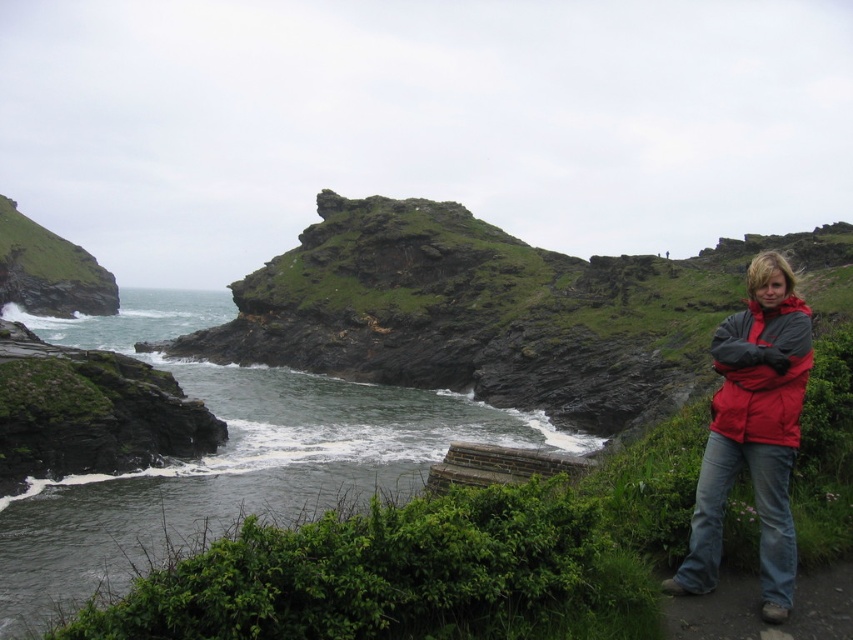
Does red fleece jacket at right have a greater height compared to brown dirt path at lower right?

Yes.

Between red fleece jacket at right and brown dirt path at lower right, which one has less height?

Standing shorter between the two is brown dirt path at lower right.

Is point (743, 400) farther from viewer compared to point (726, 602)?

That is True.

Locate an element on the screen. The image size is (853, 640). red fleece jacket at right is located at coordinates (762, 372).

Does greenish-gray water at center-left have a lesser height compared to green grassy hillside at left?

Indeed, greenish-gray water at center-left has a lesser height compared to green grassy hillside at left.

Is greenish-gray water at center-left to the left of green grassy hillside at left from the viewer's perspective?

No, greenish-gray water at center-left is not to the left of green grassy hillside at left.

Between point (148, 304) and point (56, 266), which one is positioned behind?

The point (148, 304) is behind.

This screenshot has width=853, height=640. Find the location of `greenish-gray water at center-left`. greenish-gray water at center-left is located at coordinates (225, 458).

Which is behind, point (784, 339) or point (668, 596)?

Point (784, 339)

Does point (769, 269) come farther from viewer compared to point (753, 614)?

That is True.

Locate an element on the screen. The height and width of the screenshot is (640, 853). matte red jacket at right is located at coordinates (753, 433).